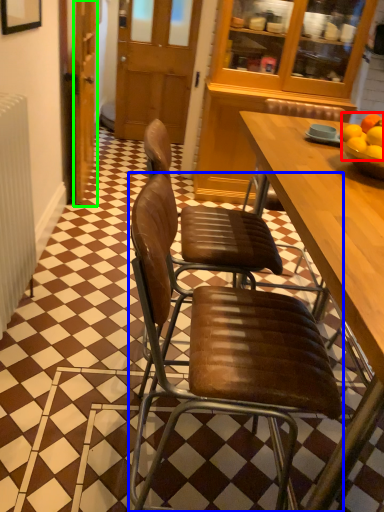
Question: Based on their relative distances, which object is nearer to fruit (highlighted by a red box)? Choose from chair (highlighted by a blue box) and door (highlighted by a green box).

Choices:
 (A) chair
 (B) door

Answer: (A)